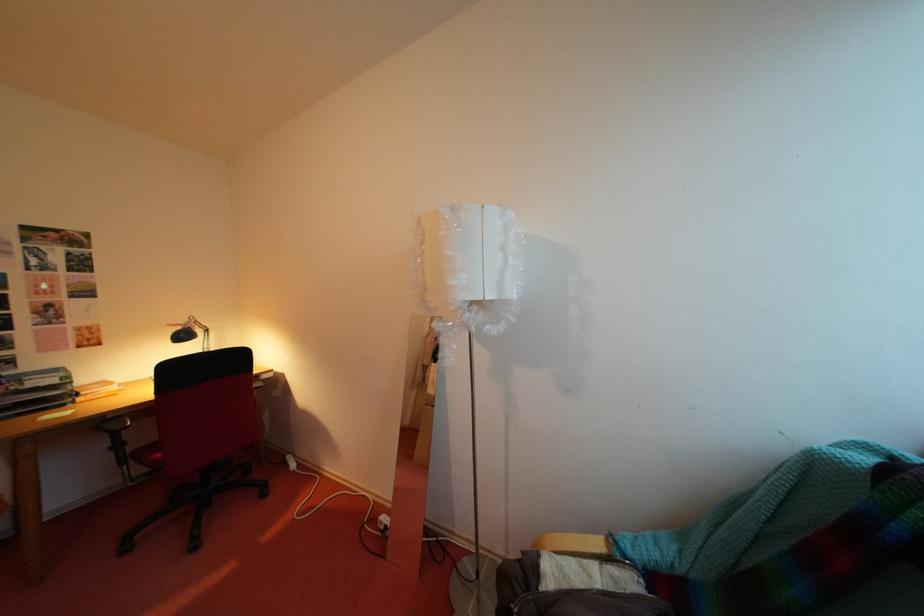
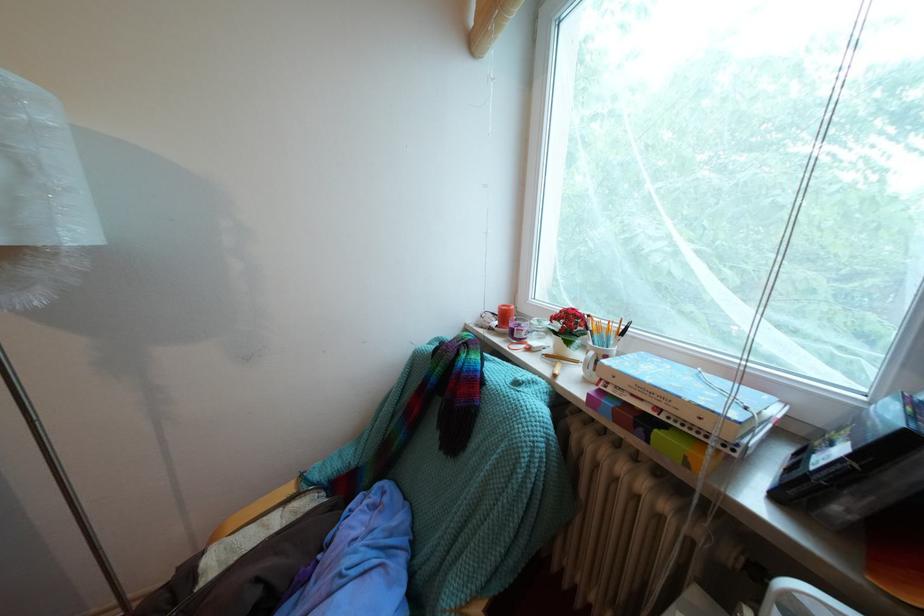
Question: The camera is either moving clockwise (left) or counter-clockwise (right) around the object. The first image is from the beginning of the video and the second image is from the end. Is the camera moving left or right when shooting the video?

Choices:
 (A) Left
 (B) Right

Answer: (A)